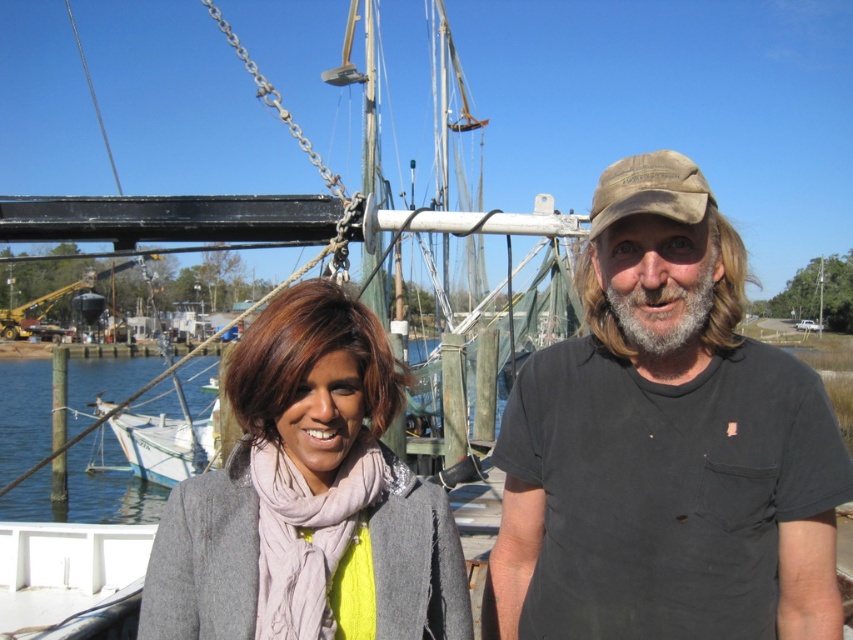
Between black cotton t-shirt at center and light gray wool coat at center, which one has more height?

With more height is black cotton t-shirt at center.

Does black cotton t-shirt at center have a smaller size compared to light gray wool coat at center?

Actually, black cotton t-shirt at center might be larger than light gray wool coat at center.

This screenshot has width=853, height=640. What do you see at coordinates (666, 444) in the screenshot?
I see `black cotton t-shirt at center` at bounding box center [666, 444].

Locate an element on the screen. The height and width of the screenshot is (640, 853). black cotton t-shirt at center is located at coordinates (666, 444).